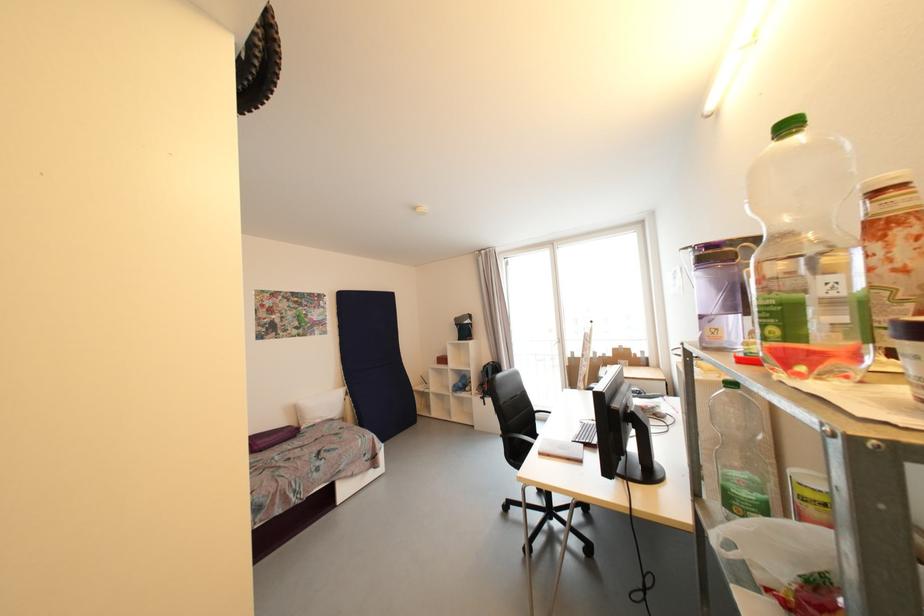
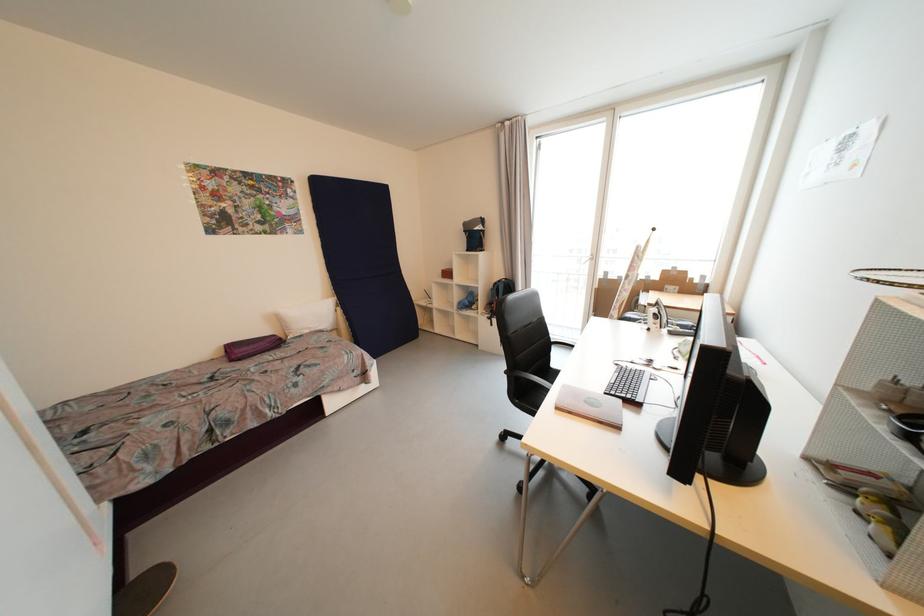
Find the pixel in the second image that matches [490,368] in the first image.

(501, 285)